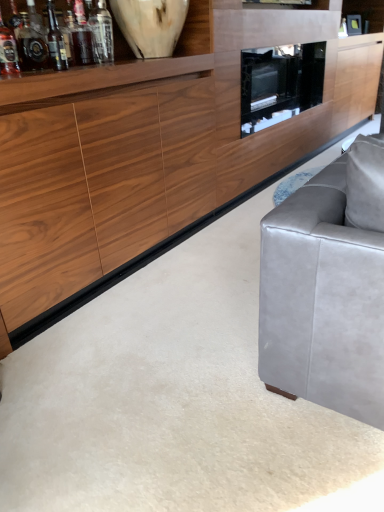
Question: Does wooden cabinet at center come in front of translucent glass bottle at upper left, the third bottle from the left?

Choices:
 (A) yes
 (B) no

Answer: (A)

Question: Does wooden cabinet at center have a lesser width compared to translucent glass bottle at upper left, the third bottle from the left?

Choices:
 (A) no
 (B) yes

Answer: (A)

Question: Does wooden cabinet at center appear on the right side of translucent glass bottle at upper left, the third bottle from the left?

Choices:
 (A) yes
 (B) no

Answer: (A)

Question: Does wooden cabinet at center have a greater width compared to translucent glass bottle at upper left, the third bottle from the left?

Choices:
 (A) no
 (B) yes

Answer: (B)

Question: Does wooden cabinet at center have a smaller size compared to translucent glass bottle at upper left, acting as the 2th bottle starting from the right?

Choices:
 (A) no
 (B) yes

Answer: (A)

Question: From a real-world perspective, relative to black glass tv cabinet at center, is translucent glass wine bottle at upper left vertically above or below?

Choices:
 (A) above
 (B) below

Answer: (A)

Question: Considering the positions of translucent glass wine bottle at upper left and black glass tv cabinet at center in the image, is translucent glass wine bottle at upper left wider or thinner than black glass tv cabinet at center?

Choices:
 (A) wide
 (B) thin

Answer: (B)

Question: Is point (48, 6) positioned closer to the camera than point (304, 64)?

Choices:
 (A) farther
 (B) closer

Answer: (B)

Question: Is translucent glass wine bottle at upper left situated inside black glass tv cabinet at center or outside?

Choices:
 (A) outside
 (B) inside

Answer: (A)

Question: Based on their sizes in the image, would you say black glass tv cabinet at center is bigger or smaller than white marble vase at upper left?

Choices:
 (A) big
 (B) small

Answer: (A)

Question: Is black glass tv cabinet at center wider or thinner than white marble vase at upper left?

Choices:
 (A) wide
 (B) thin

Answer: (A)

Question: Does point (274, 82) appear closer or farther from the camera than point (180, 15)?

Choices:
 (A) farther
 (B) closer

Answer: (A)

Question: In terms of height, does black glass tv cabinet at center look taller or shorter compared to white marble vase at upper left?

Choices:
 (A) short
 (B) tall

Answer: (B)

Question: In terms of width, does matte glass bottle at left, which is counted as the 3th bottle, starting from the right, look wider or thinner when compared to white marble vase at upper left?

Choices:
 (A) thin
 (B) wide

Answer: (A)

Question: Is matte glass bottle at left, positioned as the 2th bottle in left-to-right order, to the left or to the right of white marble vase at upper left in the image?

Choices:
 (A) left
 (B) right

Answer: (A)